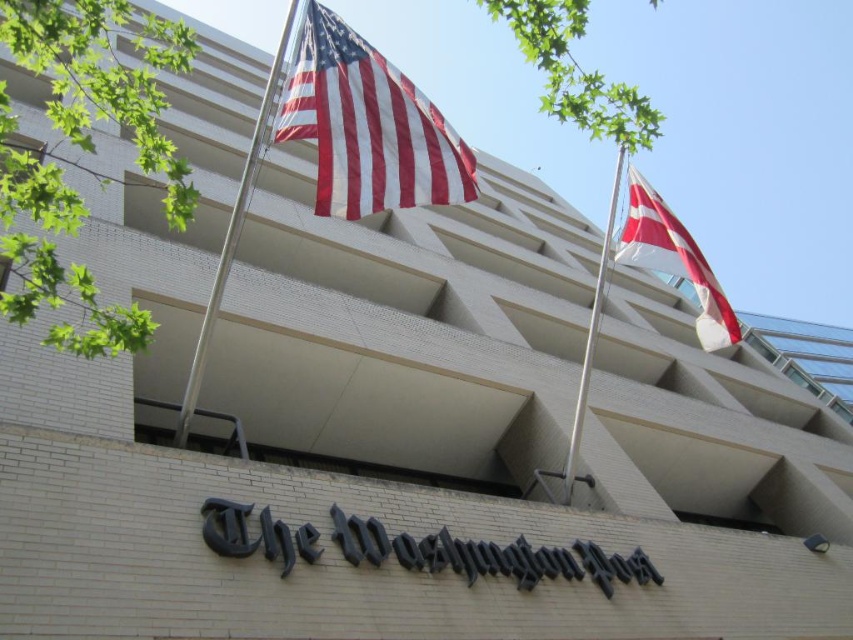
What do you see at coordinates (672, 259) in the screenshot? I see `white cotton flag at upper right` at bounding box center [672, 259].

Between white cotton flag at upper right and silver metallic flag pole at right, which one has less height?

white cotton flag at upper right

Measure the distance between point [715,333] and camera.

The distance of point [715,333] from camera is 11.46 meters.

Image resolution: width=853 pixels, height=640 pixels. I want to click on white cotton flag at upper right, so click(x=672, y=259).

Consider the image. Is red-white striped fabric flag at upper center positioned in front of metallic silver flag pole at upper center?

Yes, it is.

Who is more distant from viewer, (476, 189) or (263, 124)?

The point (476, 189) is behind.

At what (x,y) coordinates should I click in order to perform the action: click on red-white striped fabric flag at upper center. Please return your answer as a coordinate pair (x, y). This screenshot has width=853, height=640. Looking at the image, I should click on (367, 125).

Does point (258, 134) lie behind point (563, 493)?

No, (258, 134) is in front of (563, 493).

Measure the distance from metallic silver flag pole at upper center to silver metallic flag pole at right.

metallic silver flag pole at upper center and silver metallic flag pole at right are 6.65 meters apart.

The width and height of the screenshot is (853, 640). Find the location of `metallic silver flag pole at upper center`. metallic silver flag pole at upper center is located at coordinates (231, 236).

Find the location of a particular element. metallic silver flag pole at upper center is located at coordinates (231, 236).